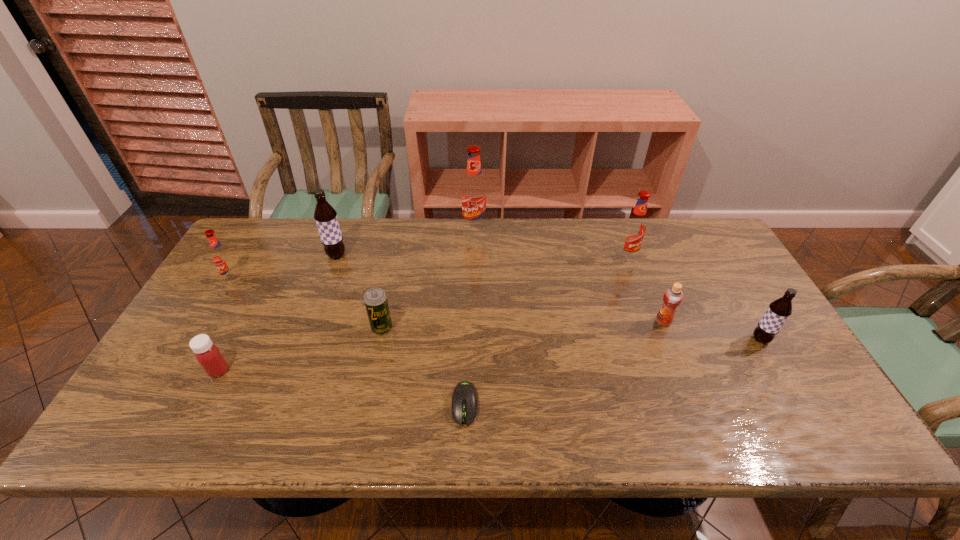
Locate an element on the screen. This screenshot has width=960, height=540. the biggest red root beer is located at coordinates (474, 192).

Locate an element on the screen. Image resolution: width=960 pixels, height=540 pixels. the second red root beer from left to right is located at coordinates (474, 192).

Image resolution: width=960 pixels, height=540 pixels. What are the coordinates of `the bigger brown root beer` in the screenshot? It's located at pos(325,216).

Identify the location of the left brown root beer. (325, 216).

You are a GUI agent. You are given a task and a screenshot of the screen. Output one action in this format:
    pyautogui.click(x=<x>, y=<y>)
    Task: Click on the second smallest red root beer
    
    Given the screenshot: What is the action you would take?
    pyautogui.click(x=634, y=229)

The image size is (960, 540). In order to click on the fourth root beer from left to right in this screenshot , I will do `click(634, 229)`.

Image resolution: width=960 pixels, height=540 pixels. What are the coordinates of `the leftmost root beer` in the screenshot? It's located at (221, 257).

This screenshot has width=960, height=540. In order to click on the nearest red root beer in this screenshot , I will do `click(221, 257)`.

What are the coordinates of `the smaller brown root beer` in the screenshot? It's located at (779, 310).

Find the location of a particular element. This screenshot has height=540, width=960. the nearest root beer is located at coordinates (779, 310).